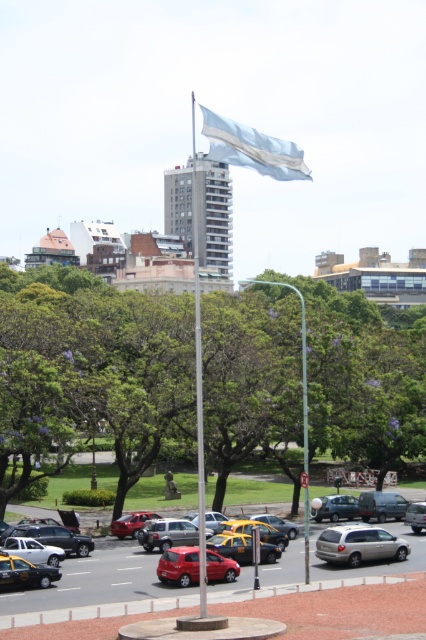
You are standing at the base of the flagpole in the urban scene. You notice a point marked at coordinates (x=166, y=532). What object does this point correspond to?

The point at coordinates (x=166, y=532) corresponds to the silver metallic sedan at center.

You are standing at the base of the flagpole in the urban scene. You want to get to the silver metallic sedan at center located at point (166,532). What direction should you walk to reach it?

The silver metallic sedan at center is located at point (166,532), so you should walk towards the center of the image to reach it.